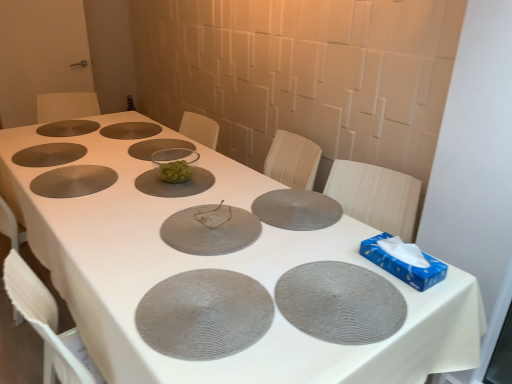
Locate an element on the screen. vacant area that is situated to the right of matte gray glass plate at center, placed as the third glass plate when sorted from front to back is located at coordinates (292, 222).